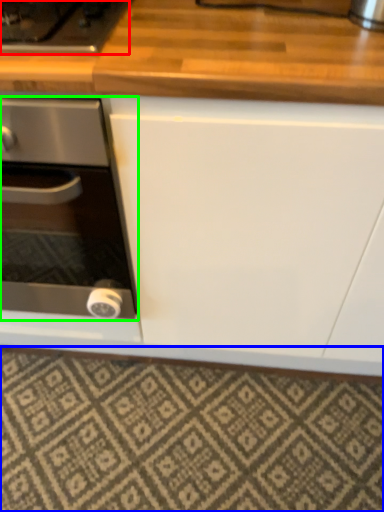
Question: Considering the real-world distances, which object is closest to gas stove (highlighted by a red box)? tile (highlighted by a blue box) or kitchen appliance (highlighted by a green box).

Choices:
 (A) tile
 (B) kitchen appliance

Answer: (B)